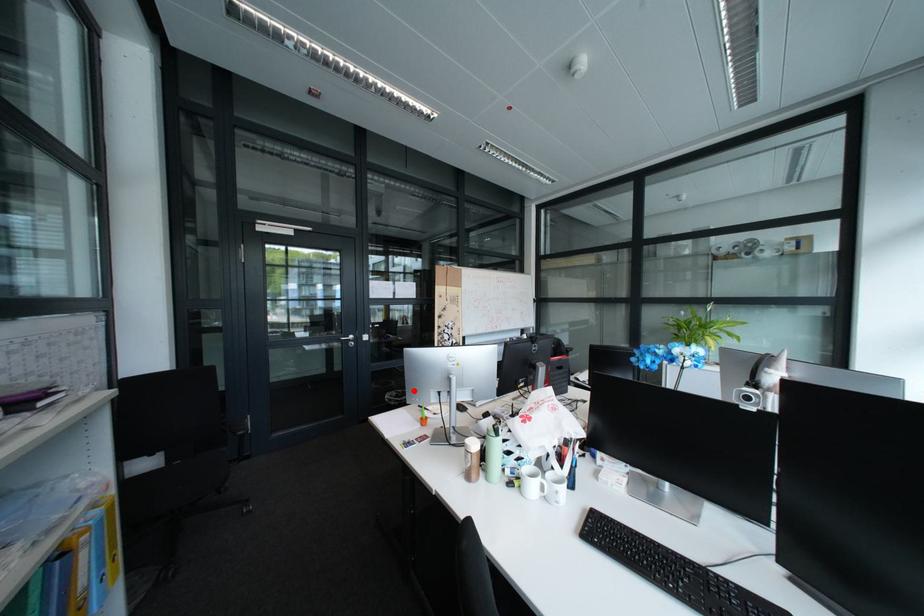
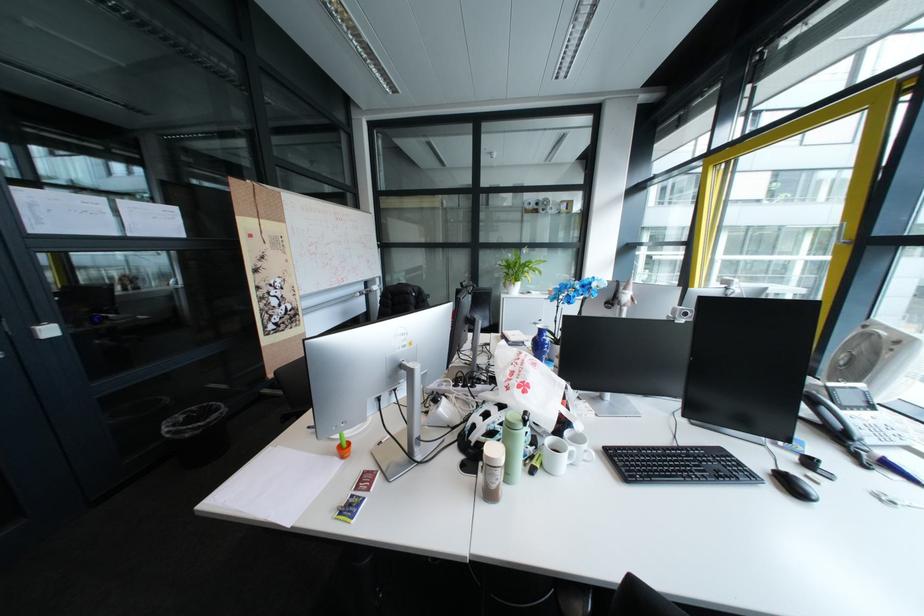
Question: I am providing you with two images of the same scene from different viewpoints. Image1 has a red point marked. In image2, the corresponding 3D location appears at what relative position? Reply with the corresponding letter.

Choices:
 (A) Closer
 (B) Farther

Answer: (A)